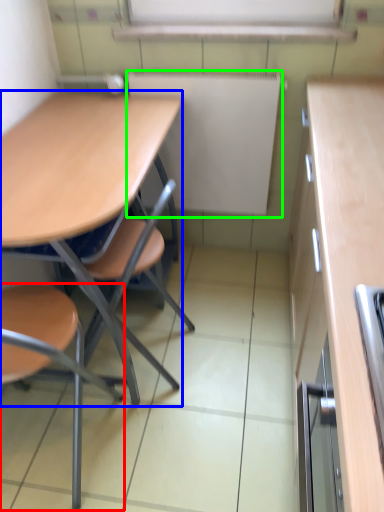
Question: Considering the real-world distances, which object is farthest from chair (highlighted by a red box)? desk (highlighted by a blue box) or bulletin board (highlighted by a green box)?

Choices:
 (A) desk
 (B) bulletin board

Answer: (B)